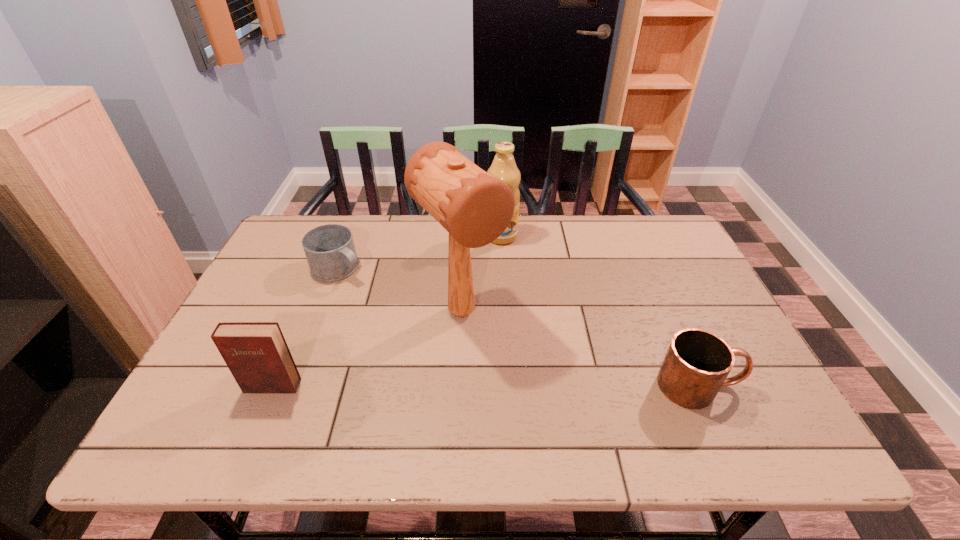
The width and height of the screenshot is (960, 540). Find the location of `vacant space at the near left corner of the desktop`. vacant space at the near left corner of the desktop is located at coordinates (220, 389).

Where is `free point at the near right corner`? Image resolution: width=960 pixels, height=540 pixels. free point at the near right corner is located at coordinates (732, 399).

I want to click on vacant area that lies between the olive oil and the farther mug, so click(420, 253).

This screenshot has width=960, height=540. Identify the location of unoccupied area between the right mug and the farther mug. (519, 327).

Where is `vacant region between the mallet and the left mug`? Image resolution: width=960 pixels, height=540 pixels. vacant region between the mallet and the left mug is located at coordinates (400, 291).

Find the location of a particular element. vacant space that is in between the mallet and the right mug is located at coordinates [581, 349].

Locate an element on the screen. vacant area between the farther mug and the diary is located at coordinates (305, 327).

This screenshot has height=540, width=960. I want to click on vacant space that is in between the diary and the farther mug, so click(x=305, y=327).

I want to click on free area in between the third shortest object and the right mug, so click(x=486, y=386).

The width and height of the screenshot is (960, 540). I want to click on vacant space in between the farther mug and the rightmost object, so click(519, 327).